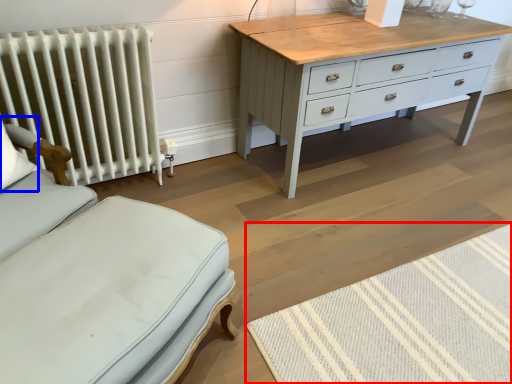
Question: Among these objects, which one is farthest to the camera, mat (highlighted by a red box) or pillow (highlighted by a blue box)?

Choices:
 (A) mat
 (B) pillow

Answer: (B)